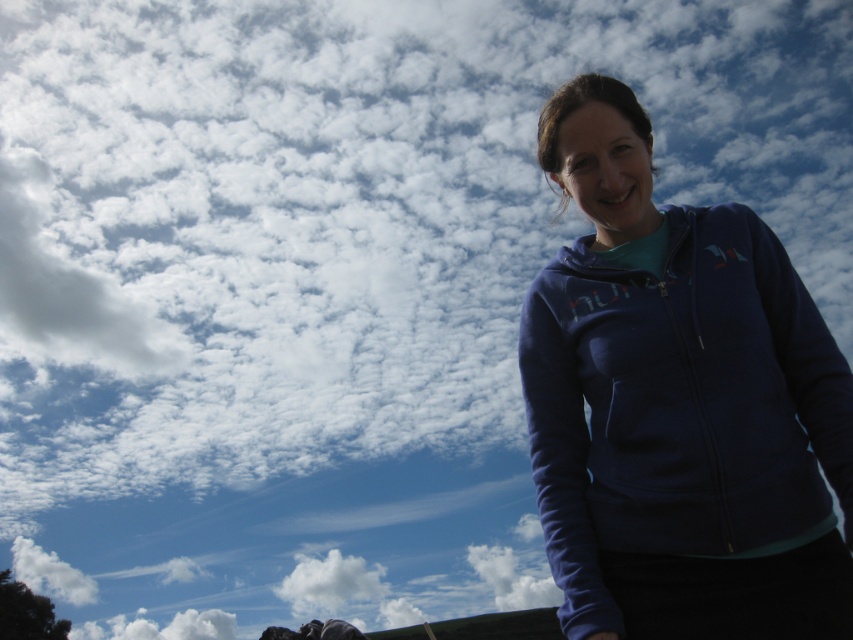
Question: Is blue fleece jacket at right positioned in front of white fluffy cloud at lower center?

Choices:
 (A) no
 (B) yes

Answer: (B)

Question: Which of the following is the closest to the observer?

Choices:
 (A) (352, 596)
 (B) (579, 115)

Answer: (B)

Question: Which point is closer to the camera?

Choices:
 (A) (335, 589)
 (B) (758, 522)

Answer: (B)

Question: Which point is farther from the camera taking this photo?

Choices:
 (A) (564, 252)
 (B) (338, 577)

Answer: (B)

Question: Is blue fleece jacket at right to the right of white fluffy cloud at lower center from the viewer's perspective?

Choices:
 (A) no
 (B) yes

Answer: (B)

Question: Can you confirm if blue fleece jacket at right is wider than white fluffy cloud at lower center?

Choices:
 (A) yes
 (B) no

Answer: (B)